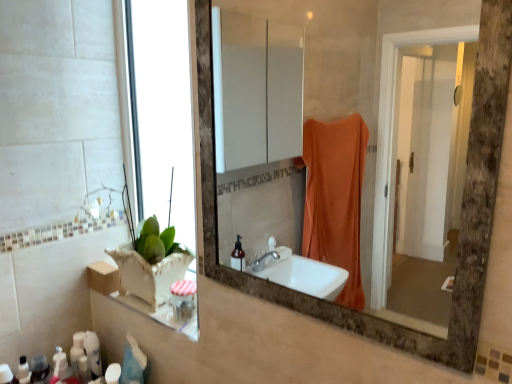
Question: Is matte brown mirror at center inside the boundaries of white matte bottle at lower left, placed as the 2th toiletry when sorted from left to right, or outside?

Choices:
 (A) inside
 (B) outside

Answer: (B)

Question: From the image's perspective, is matte brown mirror at center positioned above or below white matte bottle at lower left, positioned as the 1th toiletry in right-to-left order?

Choices:
 (A) below
 (B) above

Answer: (B)

Question: Based on their relative distances, which object is nearer to the white matte bottle at lower left, placed as the 2th toiletry when sorted from left to right?

Choices:
 (A) matte white lotion at lower left, the 1th toiletry in the left-to-right sequence
 (B) matte brown mirror at center

Answer: (A)

Question: Estimate the real-world distances between objects in this image. Which object is farther from the matte brown mirror at center?

Choices:
 (A) white matte bottle at lower left, placed as the 2th toiletry when sorted from left to right
 (B) matte white lotion at lower left, the 2th toiletry from the right

Answer: (B)